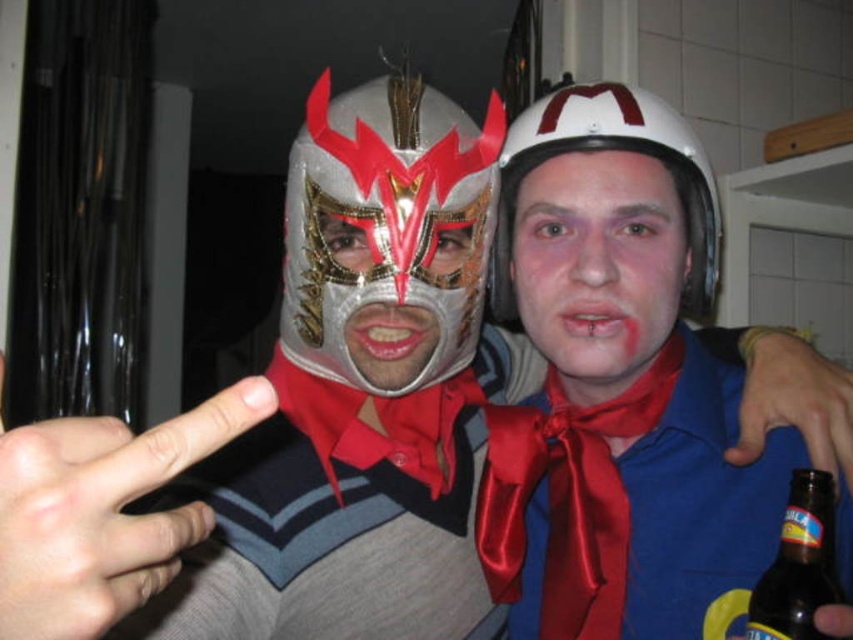
Question: Which of the following is the farthest from the observer?

Choices:
 (A) white matte helmet at center
 (B) silver metallic mask at center

Answer: (A)

Question: Which object is the closest to the metallic silver mask at center?

Choices:
 (A) brown glass bottle at lower right
 (B) white matte helmet at center
 (C) matte white helmet at center

Answer: (C)

Question: Is the position of matte white helmet at center more distant than that of brown glass bottle at lower right?

Choices:
 (A) yes
 (B) no

Answer: (A)

Question: Does matte white helmet at center have a greater width compared to white matte helmet at center?

Choices:
 (A) no
 (B) yes

Answer: (A)

Question: Which point is closer to the camera taking this photo?

Choices:
 (A) (358, 184)
 (B) (460, 307)
 (C) (547, 172)

Answer: (A)

Question: Does silver metallic mask at center appear on the left side of brown glass bottle at lower right?

Choices:
 (A) yes
 (B) no

Answer: (A)